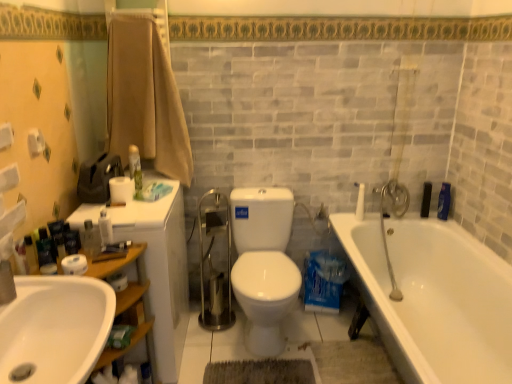
Question: Choose the correct answer: Is beige cotton towel at upper left inside white ceramic faucet at upper right or outside it?

Choices:
 (A) inside
 (B) outside

Answer: (B)

Question: In the image, is beige cotton towel at upper left positioned in front of or behind white ceramic faucet at upper right?

Choices:
 (A) front
 (B) behind

Answer: (A)

Question: Which of these objects is positioned closest to the white matte toilet paper at lower left, the 1th toilet paper from the front?

Choices:
 (A) blue plastic bottle at right, the 5th toiletry when ordered from front to back
 (B) white matte toilet paper at lower left, arranged as the 2th toilet paper when viewed from the front
 (C) matte white lotion at left, acting as the 5th toiletry starting from the back
 (D) white glossy bathtub at lower right
 (E) beige cotton towel at upper left

Answer: (C)

Question: Which of these objects is positioned farthest from the green matte spray can at upper left, the 4th toiletry in the left-to-right sequence?

Choices:
 (A) white plastic container at left, which is the third toiletry from front to back
 (B) blue plastic bottle at right, the 6th toiletry from the left
 (C) white glossy bathtub at lower right
 (D) black matte razor at right, arranged as the first toiletry when viewed from the back
 (E) matte white lotion at left, acting as the 5th toiletry starting from the back

Answer: (B)